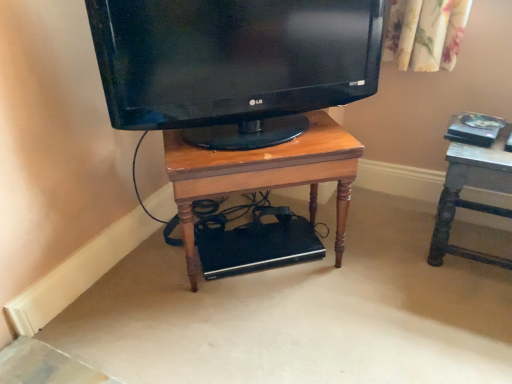
Question: Can you confirm if wooden desk at center is wider than matte black tv at center?

Choices:
 (A) yes
 (B) no

Answer: (A)

Question: Is the position of wooden desk at center less distant than that of matte black tv at center?

Choices:
 (A) no
 (B) yes

Answer: (A)

Question: From a real-world perspective, is wooden desk at center positioned over matte black tv at center based on gravity?

Choices:
 (A) no
 (B) yes

Answer: (A)

Question: Are wooden desk at center and matte black tv at center located far from each other?

Choices:
 (A) yes
 (B) no

Answer: (B)

Question: Are wooden desk at center and matte black tv at center making contact?

Choices:
 (A) yes
 (B) no

Answer: (B)

Question: Considering the relative positions of matte black tv at center and wooden table at right in the image provided, is matte black tv at center to the left or to the right of wooden table at right?

Choices:
 (A) left
 (B) right

Answer: (A)

Question: From their relative heights in the image, would you say matte black tv at center is taller or shorter than wooden table at right?

Choices:
 (A) short
 (B) tall

Answer: (A)

Question: Looking at the image, does matte black tv at center seem bigger or smaller compared to wooden table at right?

Choices:
 (A) small
 (B) big

Answer: (B)

Question: From the image's perspective, is matte black tv at center located above or below wooden table at right?

Choices:
 (A) below
 (B) above

Answer: (B)

Question: Choose the correct answer: Is wooden desk at center inside wooden table at right or outside it?

Choices:
 (A) outside
 (B) inside

Answer: (A)

Question: In the image, is wooden desk at center on the left side or the right side of wooden table at right?

Choices:
 (A) right
 (B) left

Answer: (B)

Question: Considering their positions, is wooden desk at center located in front of or behind wooden table at right?

Choices:
 (A) front
 (B) behind

Answer: (A)

Question: From a real-world perspective, relative to wooden table at right, is wooden desk at center vertically above or below?

Choices:
 (A) above
 (B) below

Answer: (A)

Question: Would you say matte black tv at center is to the left or to the right of wooden desk at center in the picture?

Choices:
 (A) left
 (B) right

Answer: (A)

Question: Looking at their shapes, would you say matte black tv at center is wider or thinner than wooden desk at center?

Choices:
 (A) thin
 (B) wide

Answer: (A)